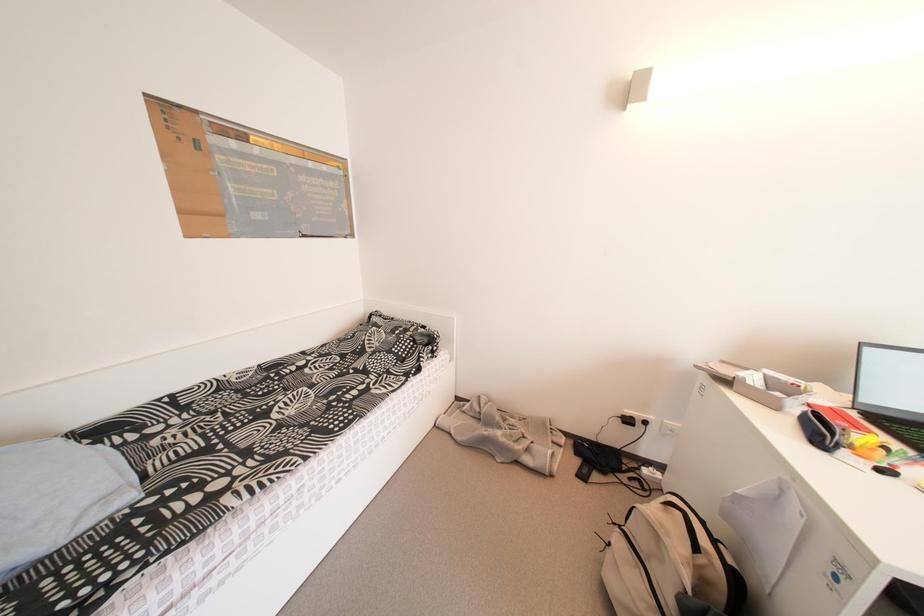
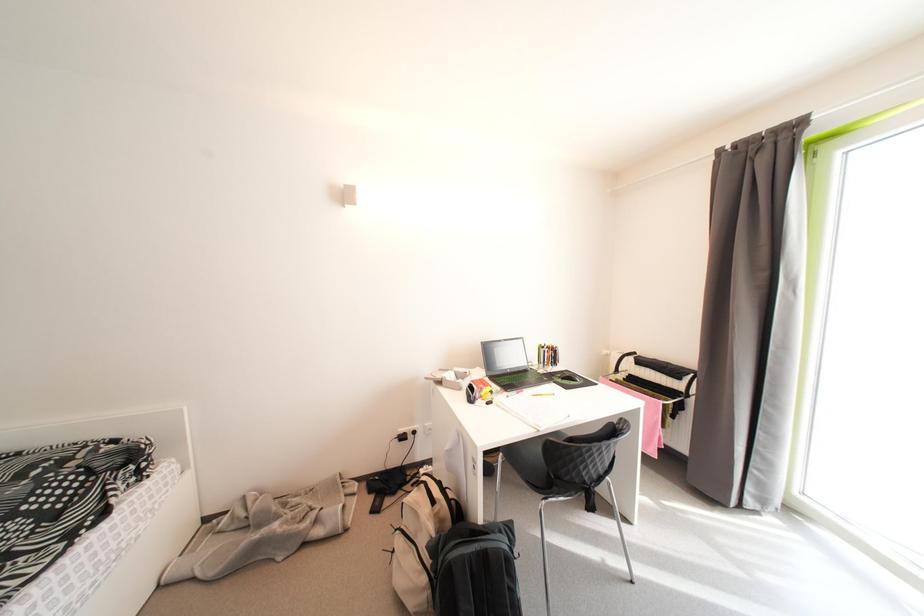
Question: The camera is either moving clockwise (left) or counter-clockwise (right) around the object. The first image is from the beginning of the video and the second image is from the end. Is the camera moving left or right when shooting the video?

Choices:
 (A) Left
 (B) Right

Answer: (A)